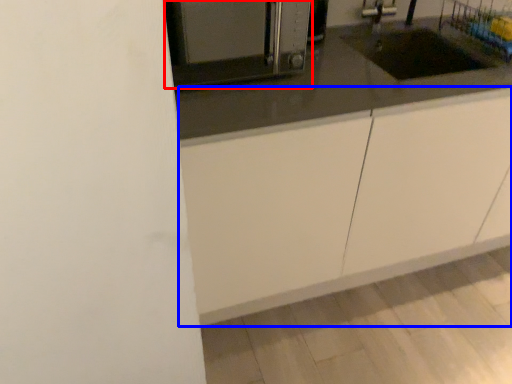
Question: Which of the following is the closest to the observer, home appliance (highlighted by a red box) or cabinetry (highlighted by a blue box)?

Choices:
 (A) home appliance
 (B) cabinetry

Answer: (A)